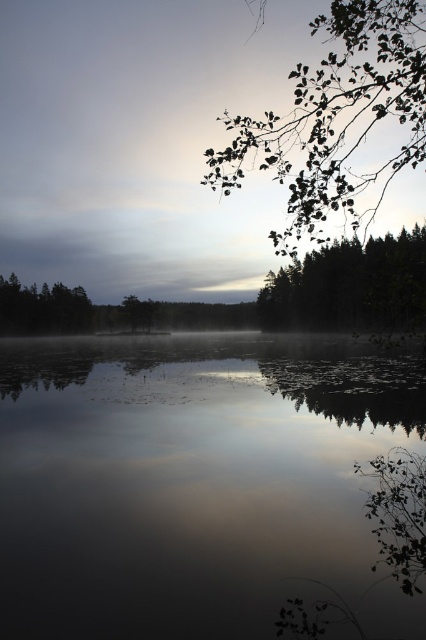
Consider the image. Does green leafy branches at upper right appear over green leafy tree at upper right?

Correct, green leafy branches at upper right is located above green leafy tree at upper right.

Measure the distance between green leafy branches at upper right and camera.

The distance of green leafy branches at upper right from camera is 27.02 feet.

Does point (270, 161) lie in front of point (327, 262)?

Yes, it is.

At what (x,y) coordinates should I click in order to perform the action: click on green leafy branches at upper right. Please return your answer as a coordinate pair (x, y). The width and height of the screenshot is (426, 640). Looking at the image, I should click on (336, 116).

Which is in front, point (235, 490) or point (86, 68)?

Point (235, 490)

Is point (52, 470) in front of point (77, 198)?

Yes, it is in front of point (77, 198).

Image resolution: width=426 pixels, height=640 pixels. Identify the location of smooth reflective water at center. (195, 481).

Is smooth reflective water at center shorter than green leafy tree at upper right?

Indeed, smooth reflective water at center has a lesser height compared to green leafy tree at upper right.

How much distance is there between smooth reflective water at center and green leafy tree at upper right?

27.01 meters

You are a GUI agent. You are given a task and a screenshot of the screen. Output one action in this format:
    pyautogui.click(x=<x>, y=<y>)
    Task: Click on the smooth reflective water at center
    The height and width of the screenshot is (640, 426).
    Given the screenshot: What is the action you would take?
    pyautogui.click(x=195, y=481)